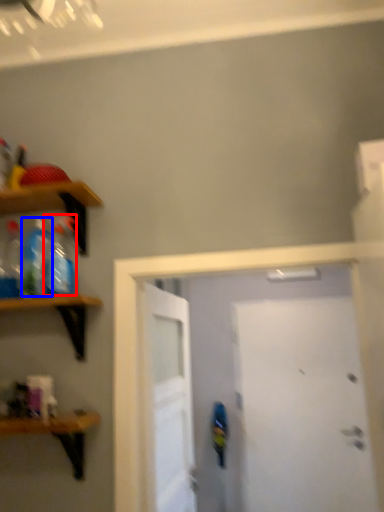
Question: Which point is closer to the camera, bottle (highlighted by a red box) or bottle (highlighted by a blue box)?

Choices:
 (A) bottle
 (B) bottle

Answer: (A)